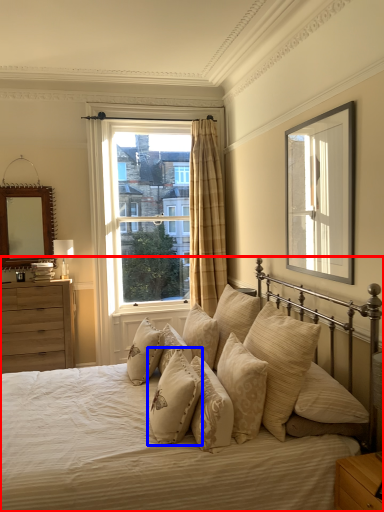
Question: Which object is closer to the camera taking this photo, bed (highlighted by a red box) or pillow (highlighted by a blue box)?

Choices:
 (A) bed
 (B) pillow

Answer: (A)